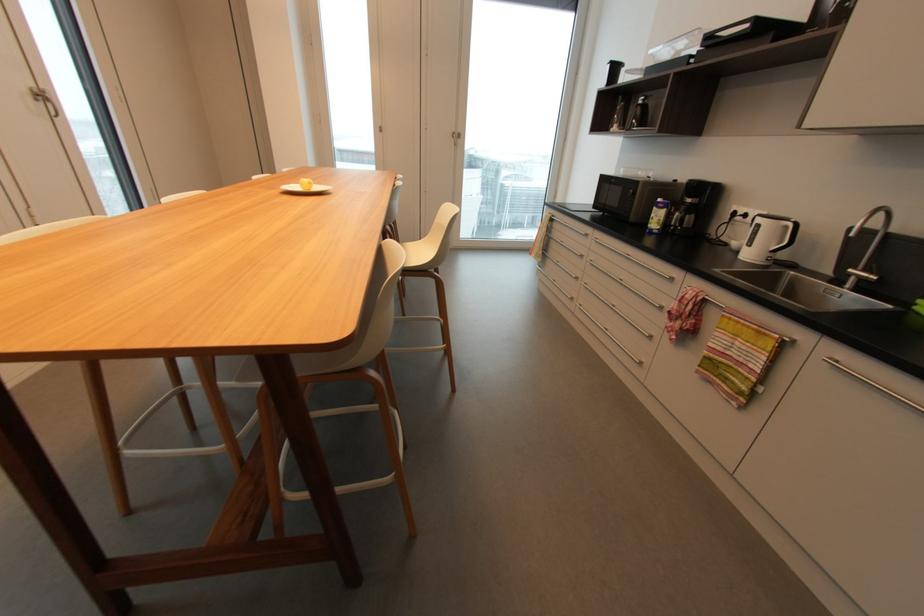
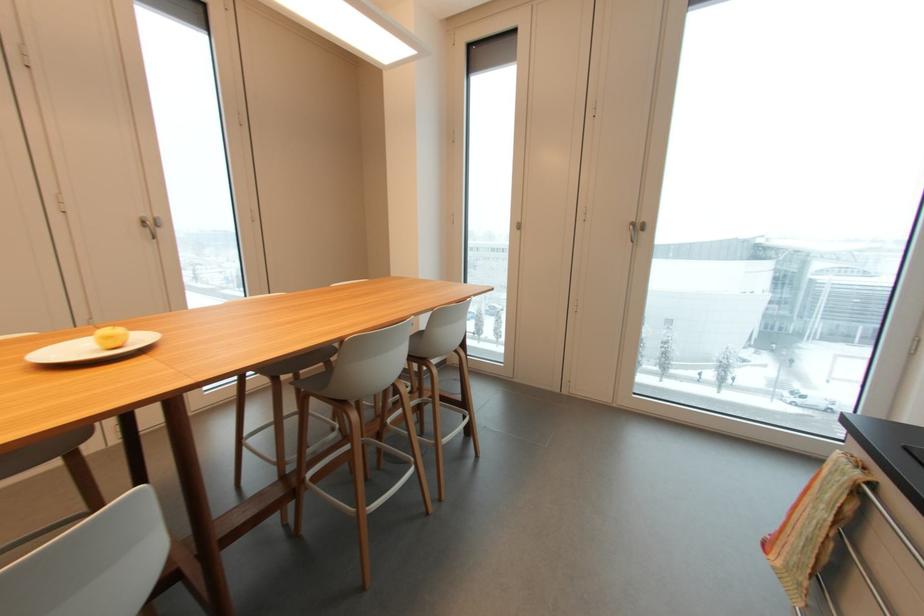
In the second image, find the point that corresponds to pixel 35 91 in the first image.

(143, 217)